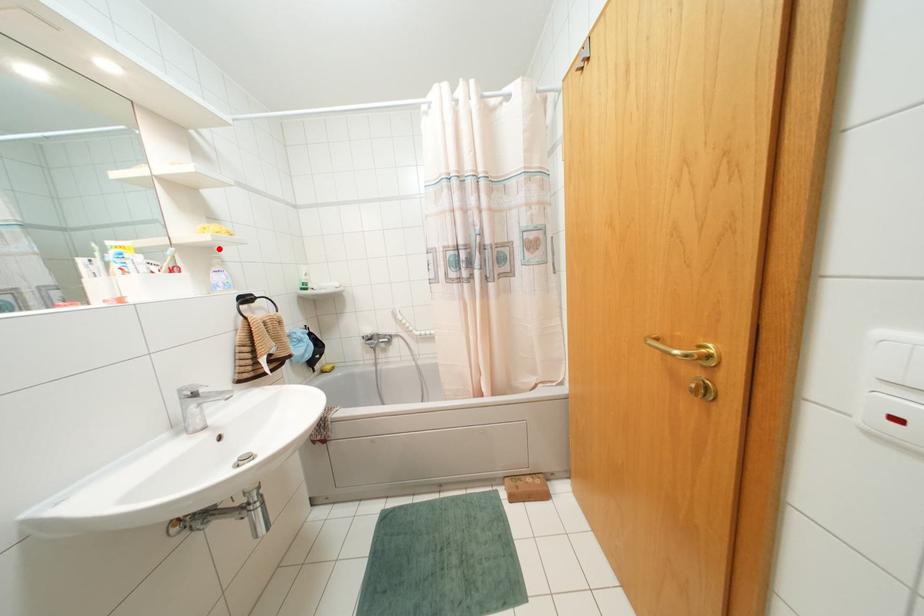
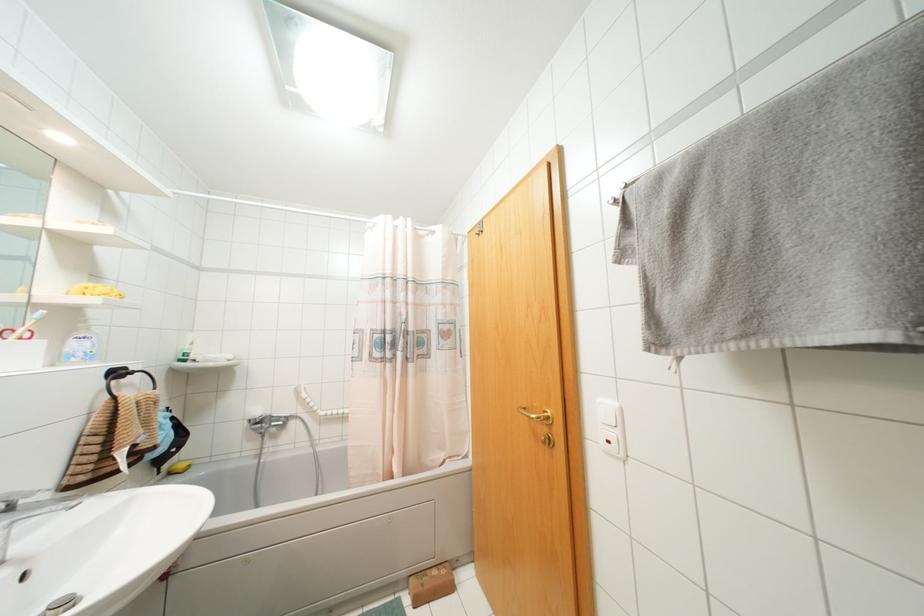
In the second image, find the point that corresponds to the highlighted location in the first image.

(89, 310)